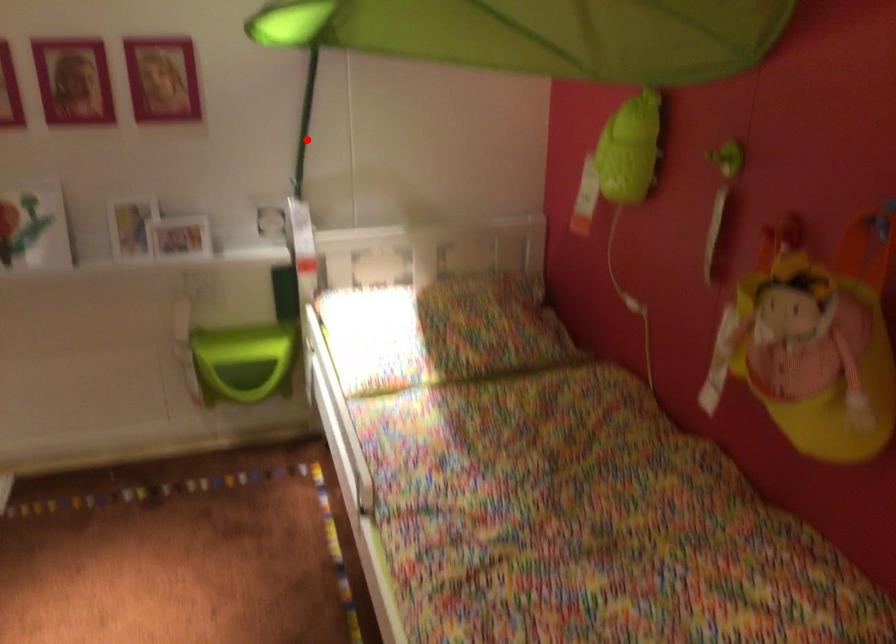
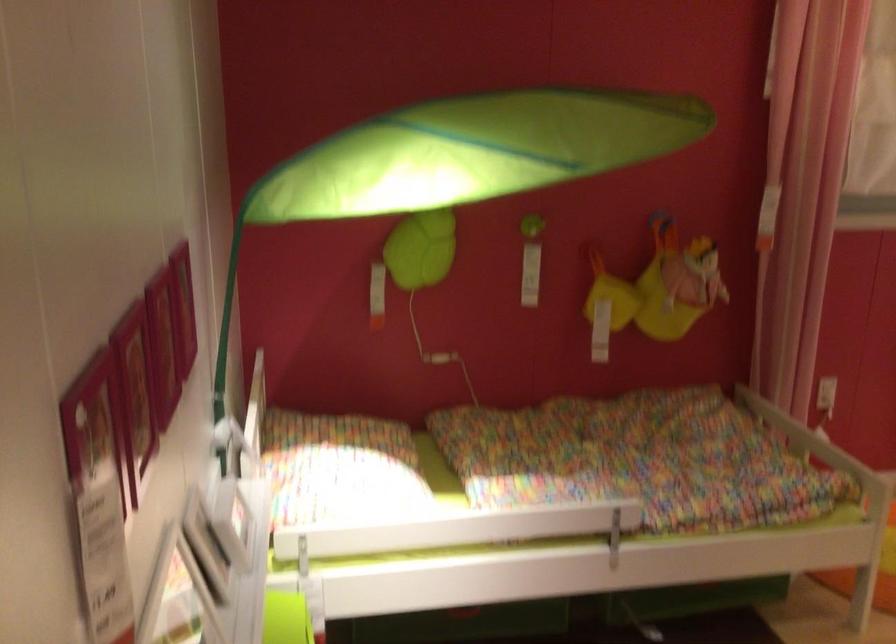
Locate, in the second image, the point that corresponds to the highlighted location in the first image.

(226, 339)